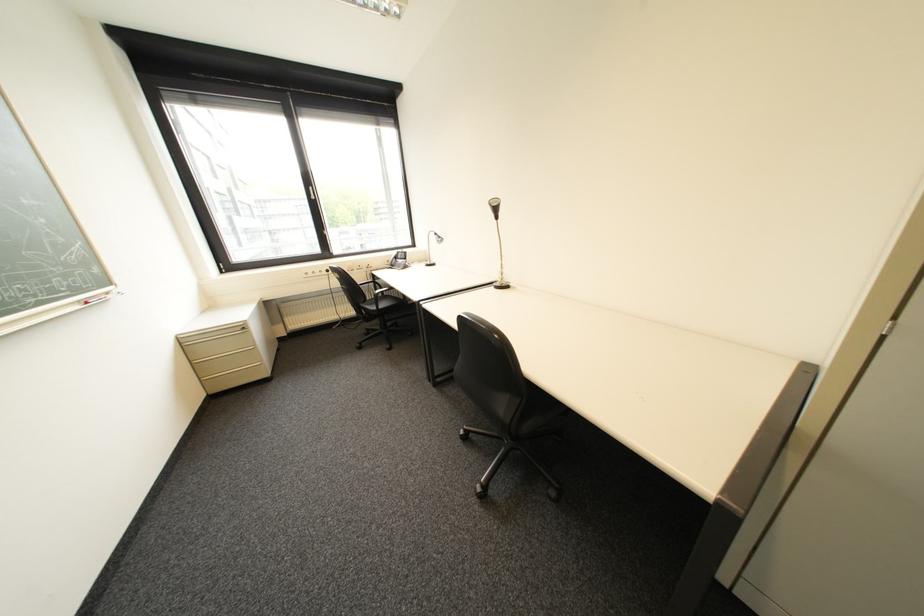
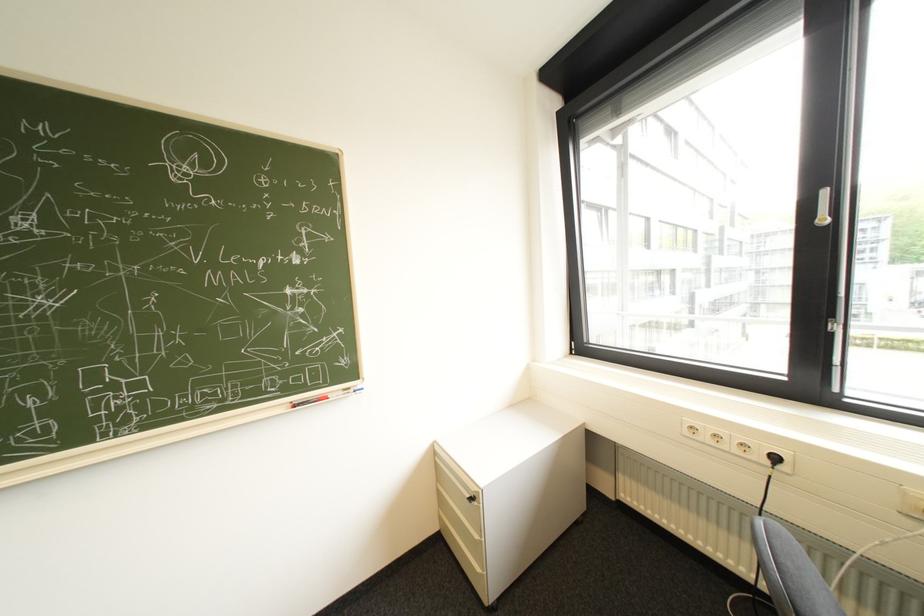
The point at (253, 329) is marked in the first image. Where is the corresponding point in the second image?

(482, 499)